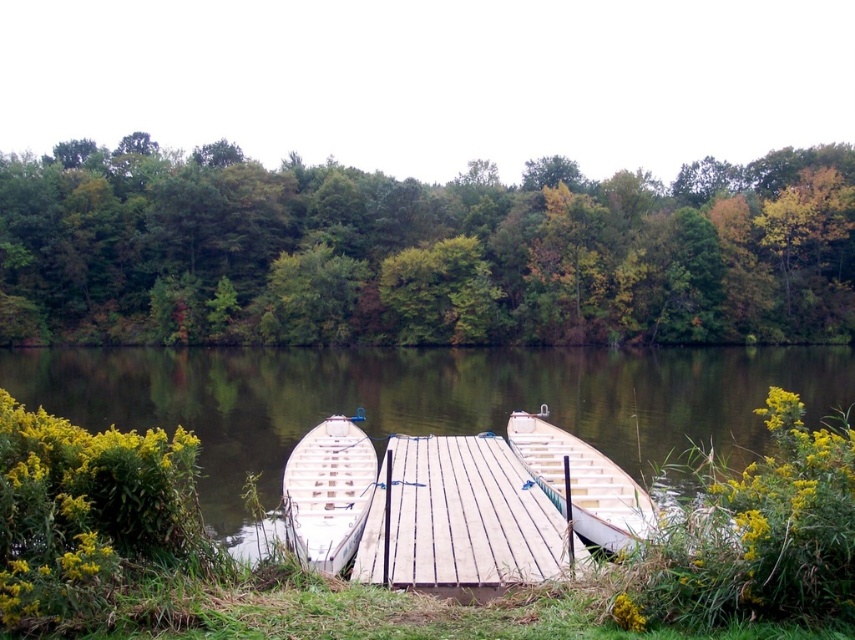
You are standing on the dock and looking towards the lake. Which object is positioned higher in the scene, the green leafy trees at upper center or the light brown wooden canoe at center?

The green leafy trees at upper center are positioned higher in the scene than the light brown wooden canoe at center.

From the picture: What are the coordinates of the green leafy trees at upper center in the image?

The green leafy trees at upper center are located at coordinates point [420,250].

You are standing on the dock and want to take a photo of the green leafy trees at upper center and the light brown wooden canoe at center. Which object should you focus on first to ensure both are in the frame?

You should focus on the green leafy trees at upper center first because they are closer to you than the light brown wooden canoe at center, so adjusting the camera to capture them ensures the canoe will also be in view.